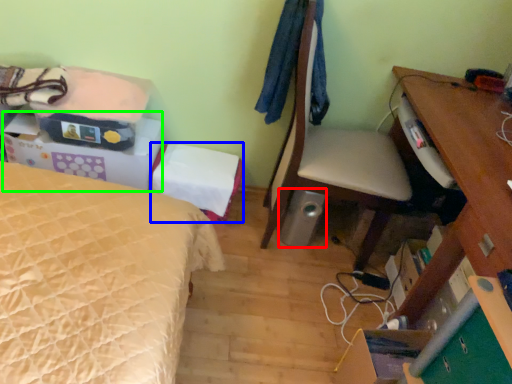
Question: Which is nearer to the loudspeaker (highlighted by a red box)? storage box (highlighted by a blue box) or storage box (highlighted by a green box).

Choices:
 (A) storage box
 (B) storage box

Answer: (A)